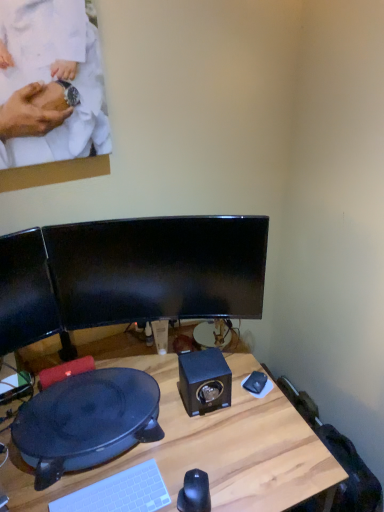
The image size is (384, 512). What are the coordinates of `free space to the left of white plastic keyboard at lower center` in the screenshot? It's located at (46, 485).